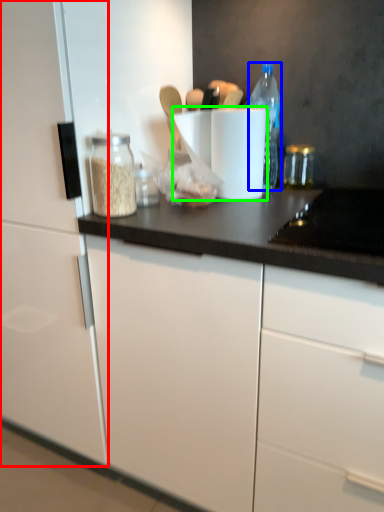
Question: Which is nearer to the cabinetry (highlighted by a red box)? bottle (highlighted by a blue box) or paper towel (highlighted by a green box).

Choices:
 (A) bottle
 (B) paper towel

Answer: (B)